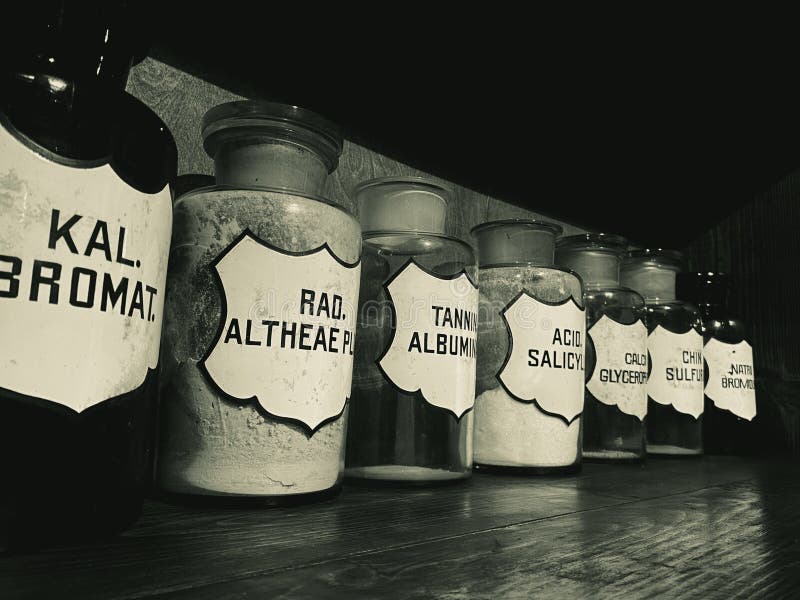
This screenshot has width=800, height=600. In order to click on wood boards in this screenshot , I will do `click(578, 565)`, `click(376, 526)`.